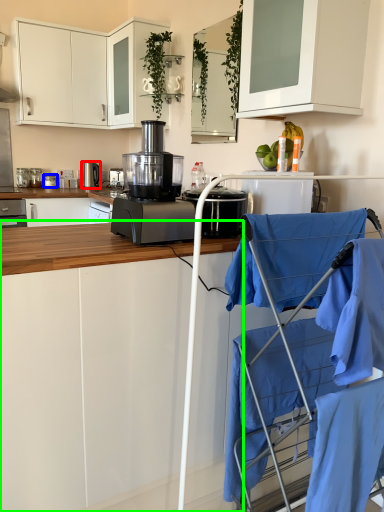
Question: Which object is the farthest from home appliance (highlighted by a red box)? Choose among these: kitchen appliance (highlighted by a blue box) or cabinetry (highlighted by a green box).

Choices:
 (A) kitchen appliance
 (B) cabinetry

Answer: (B)